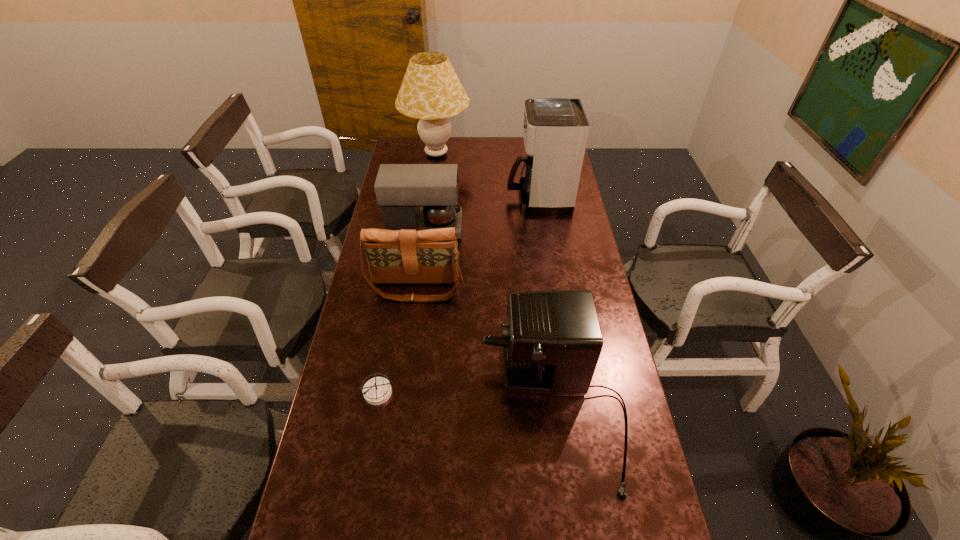
Locate an element on the screen. the farthest object is located at coordinates 431,91.

Where is `the tallest coffee maker`? The height and width of the screenshot is (540, 960). the tallest coffee maker is located at coordinates (555, 130).

Find the location of a particular element. the farthest coffee maker is located at coordinates (555, 130).

You are a GUI agent. You are given a task and a screenshot of the screen. Output one action in this format:
    pyautogui.click(x=<x>, y=<y>)
    Task: Click on the nearest coffee maker
    The image size is (960, 540).
    Given the screenshot: What is the action you would take?
    pyautogui.click(x=552, y=341)

The image size is (960, 540). Find the location of `the fourth nearest object`. the fourth nearest object is located at coordinates (400, 189).

At what (x,y) coordinates should I click in order to perform the action: click on the second farthest coffee maker. Please return your answer as a coordinate pair (x, y). This screenshot has width=960, height=540. Looking at the image, I should click on (400, 189).

Where is `shoulder bag`? The width and height of the screenshot is (960, 540). shoulder bag is located at coordinates (394, 256).

Identify the location of the shortest object. Image resolution: width=960 pixels, height=540 pixels. (376, 391).

The height and width of the screenshot is (540, 960). What are the coordinates of `free spot located on the front of the lampshade` in the screenshot? It's located at (432, 188).

Image resolution: width=960 pixels, height=540 pixels. In order to click on vacant space located 0.230m on the front panel of the fifth nearest object in this screenshot , I will do `click(454, 198)`.